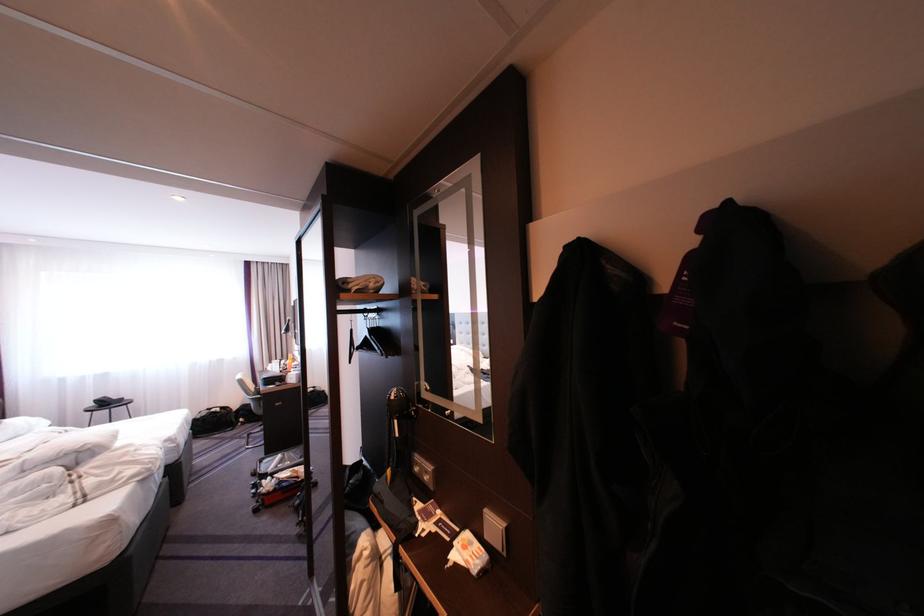
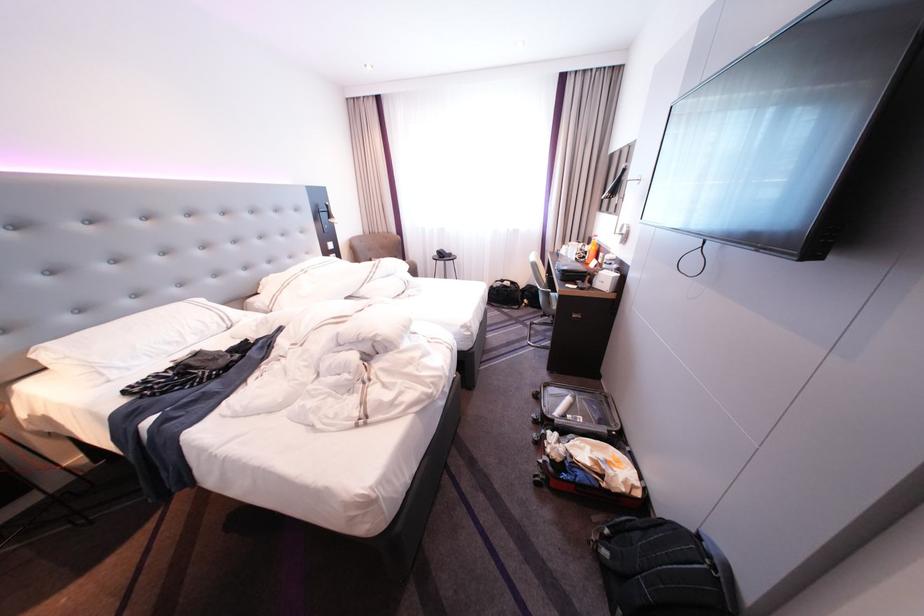
Locate, in the second image, the point that corresponds to point 264,427 in the first image.

(546, 314)